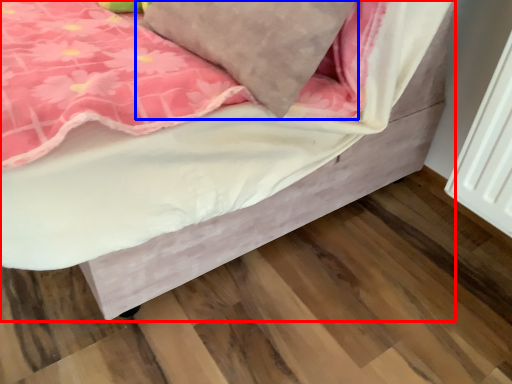
Question: Which object is further to the camera taking this photo, bed (highlighted by a red box) or pillow (highlighted by a blue box)?

Choices:
 (A) bed
 (B) pillow

Answer: (B)